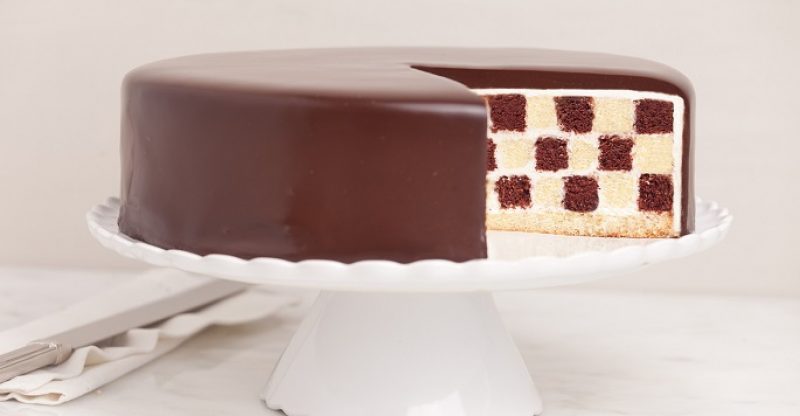
I want to click on empty countertop to right of cake plate, so click(634, 360).